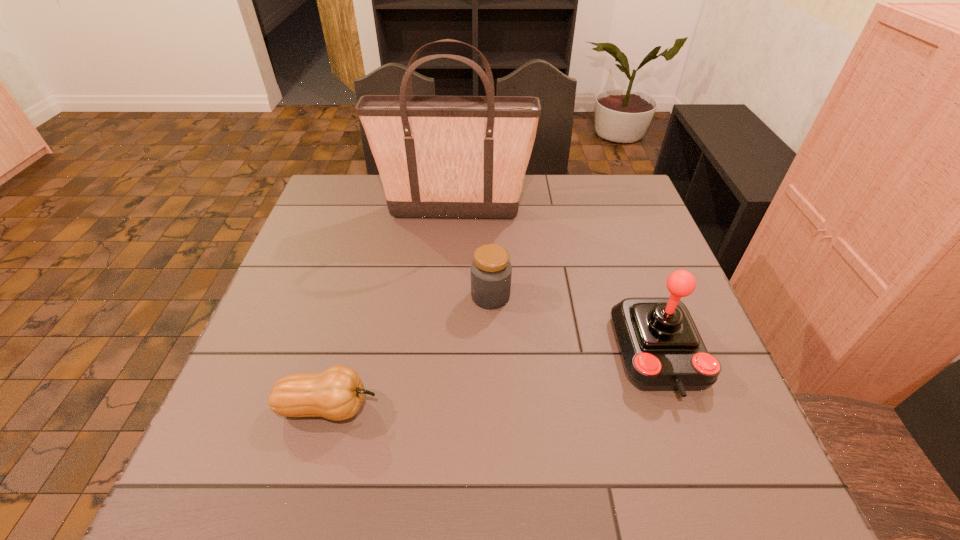
Locate an element on the screen. free location located 0.260m on the surface of the second shortest object near the warning symbol is located at coordinates (366, 296).

Find the location of a particular element. The height and width of the screenshot is (540, 960). vacant space situated on the stem side of the gourd is located at coordinates (516, 407).

In order to click on object at the far edge in this screenshot , I will do `click(457, 157)`.

This screenshot has height=540, width=960. Identify the location of object positioned at the left edge. (336, 394).

Where is `object located at the right edge`? This screenshot has height=540, width=960. object located at the right edge is located at coordinates (662, 348).

Image resolution: width=960 pixels, height=540 pixels. Identify the location of vacant area at the near edge of the desktop. (354, 483).

The width and height of the screenshot is (960, 540). Find the location of `vacant space at the left edge of the desktop`. vacant space at the left edge of the desktop is located at coordinates (281, 352).

Locate an element on the screen. free region at the right edge of the desktop is located at coordinates (670, 399).

The height and width of the screenshot is (540, 960). I want to click on vacant space at the far left corner of the desktop, so click(x=318, y=217).

Identify the location of vacant space at the near left corner of the desktop. The width and height of the screenshot is (960, 540). (213, 478).